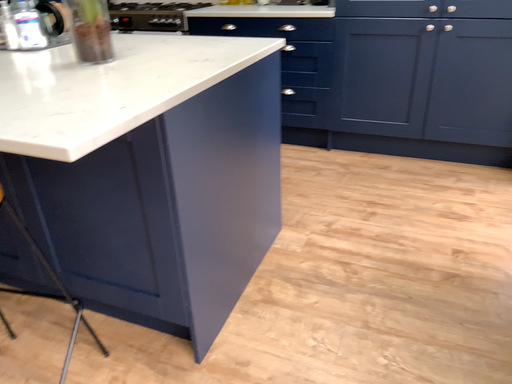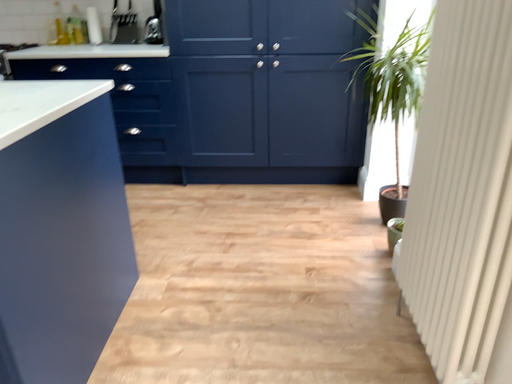
Question: How did the camera likely rotate when shooting the video?

Choices:
 (A) rotated left
 (B) rotated right

Answer: (B)